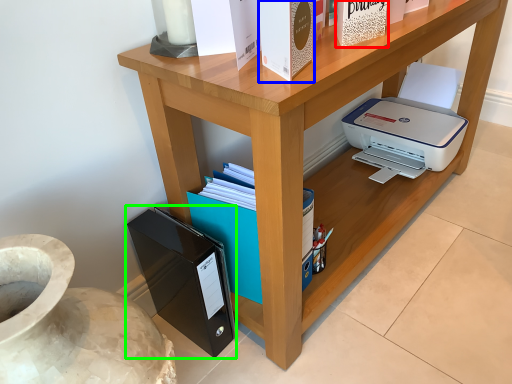
Question: Which is nearer to the paperback book (highlighted by a red box)? paperback book (highlighted by a blue box) or paperback book (highlighted by a green box).

Choices:
 (A) paperback book
 (B) paperback book

Answer: (A)